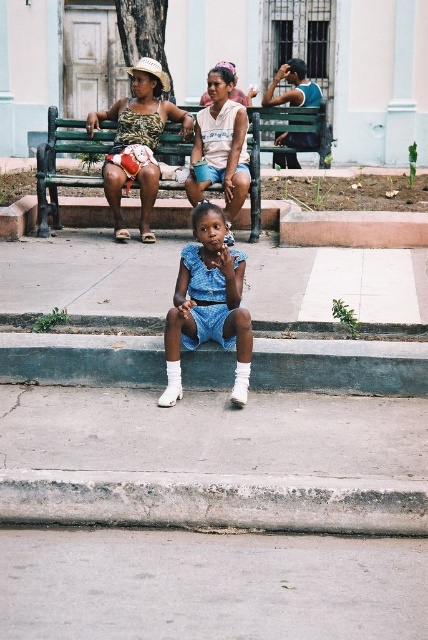
Can you confirm if green wooden bench at center is positioned to the right of blue-green fabric shirt at upper right?

No, green wooden bench at center is not to the right of blue-green fabric shirt at upper right.

Can you confirm if green wooden bench at center is shorter than blue-green fabric shirt at upper right?

In fact, green wooden bench at center may be taller than blue-green fabric shirt at upper right.

Does point (256, 209) come behind point (282, 99)?

No, (256, 209) is in front of (282, 99).

At what (x,y) coordinates should I click in order to perform the action: click on green wooden bench at center. Please return your answer as a coordinate pair (x, y). Looking at the image, I should click on (67, 170).

Can you confirm if gray concrete curb at lower center is shorter than blue-green fabric shirt at upper right?

Yes, gray concrete curb at lower center is shorter than blue-green fabric shirt at upper right.

Is gray concrete curb at lower center thinner than blue-green fabric shirt at upper right?

In fact, gray concrete curb at lower center might be wider than blue-green fabric shirt at upper right.

Which is behind, point (172, 525) or point (284, 168)?

The point (284, 168) is behind.

Locate an element on the screen. This screenshot has height=640, width=428. gray concrete curb at lower center is located at coordinates (214, 500).

Is green concrete curb at lower center bigger than blue-green fabric shirt at upper right?

Actually, green concrete curb at lower center might be smaller than blue-green fabric shirt at upper right.

The image size is (428, 640). Describe the element at coordinates (341, 365) in the screenshot. I see `green concrete curb at lower center` at that location.

Find the location of a particular element. Image resolution: width=428 pixels, height=640 pixels. green concrete curb at lower center is located at coordinates (341, 365).